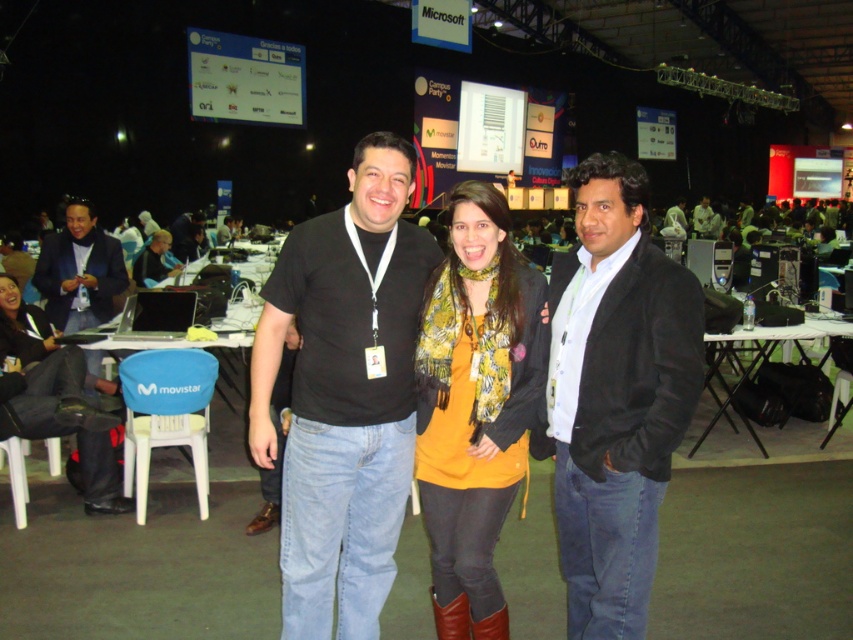
Question: Estimate the real-world distances between objects in this image. Which object is farther from the matte black jacket at center?

Choices:
 (A) matte black jacket at left
 (B) black matte t-shirt at center

Answer: (B)

Question: Can you confirm if black cotton jacket at center is positioned to the right of brown leather boot at lower center?

Choices:
 (A) yes
 (B) no

Answer: (A)

Question: Is black matte t-shirt at center to the left of light brown leather jacket at center from the viewer's perspective?

Choices:
 (A) yes
 (B) no

Answer: (A)

Question: Which object is farther from the camera taking this photo?

Choices:
 (A) black cotton jacket at center
 (B) yellow matte sweater at center
 (C) light brown leather jacket at center

Answer: (C)

Question: Is brown leather boot at lower center thinner than matte black jacket at center?

Choices:
 (A) no
 (B) yes

Answer: (B)

Question: Which is farther from the matte black laptop at left?

Choices:
 (A) matte black jacket at center
 (B) black cotton jacket at center
 (C) black matte t-shirt at center

Answer: (A)